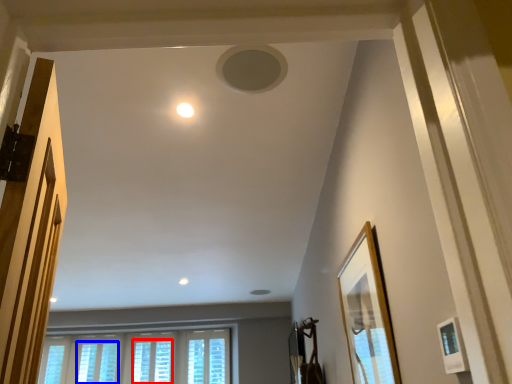
Question: Which object appears closest to the camera in this image, window (highlighted by a red box) or window (highlighted by a blue box)?

Choices:
 (A) window
 (B) window

Answer: (B)